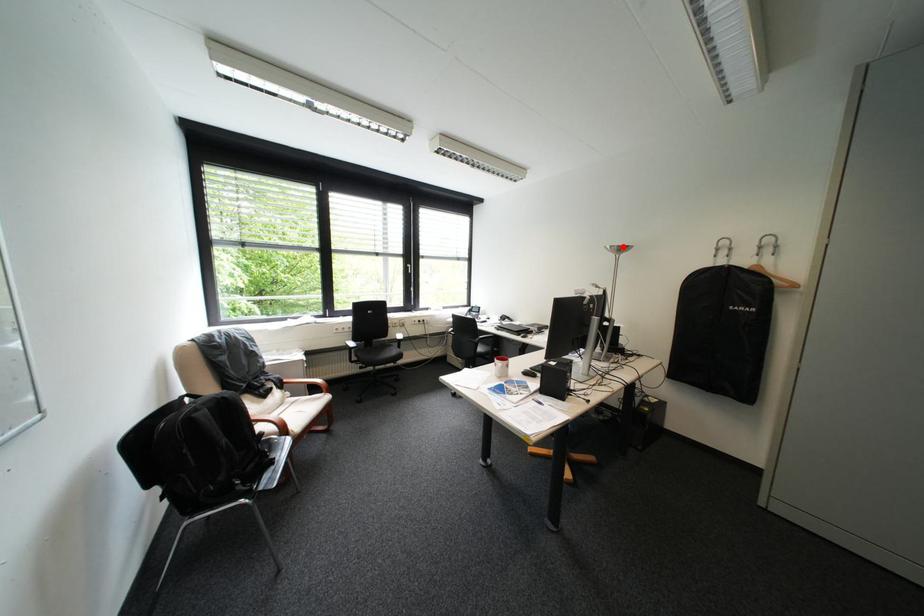
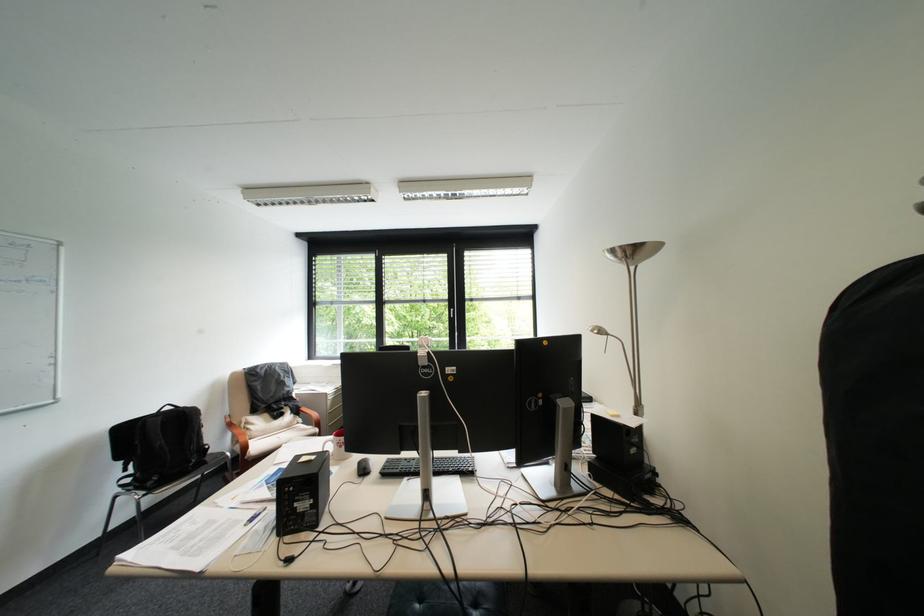
Where in the second image is the point corresponding to the highlighted location from the first image?

(625, 252)